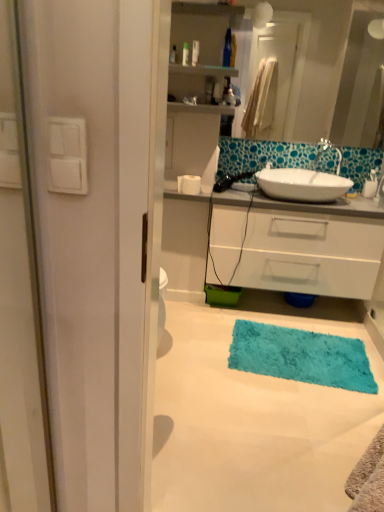
Question: Considering the positions of point (230, 29) and point (360, 77), is point (230, 29) closer or farther from the camera than point (360, 77)?

Choices:
 (A) farther
 (B) closer

Answer: (B)

Question: Is translucent plastic bottle at upper center in front of or behind white glossy mirror at upper center in the image?

Choices:
 (A) front
 (B) behind

Answer: (A)

Question: Considering the real-world distances, which object is farthest from the translucent plastic bottle at upper center?

Choices:
 (A) white glossy mirror at upper center
 (B) white glossy cabinet at center
 (C) turquoise shaggy rug at lower center
 (D) white matte toilet paper at center
 (E) white glossy sink at center

Answer: (A)

Question: Which object is the closest to the turquoise shaggy bath mat at lower center?

Choices:
 (A) white glossy sink at center
 (B) turquoise shaggy rug at lower center
 (C) white glossy cabinet at center
 (D) translucent plastic bottle at upper center
 (E) white matte toilet paper at center

Answer: (B)